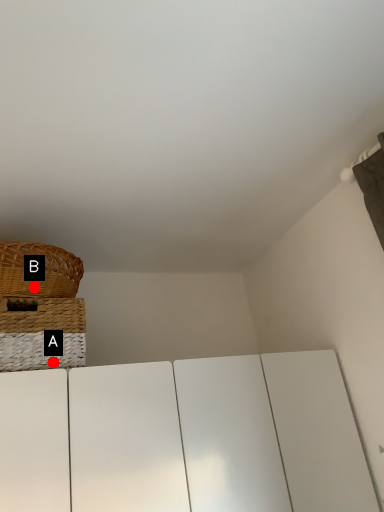
Question: Two points are circled on the image, labeled by A and B beside each circle. Which point is farther to the camera?

Choices:
 (A) A is further
 (B) B is further

Answer: (B)